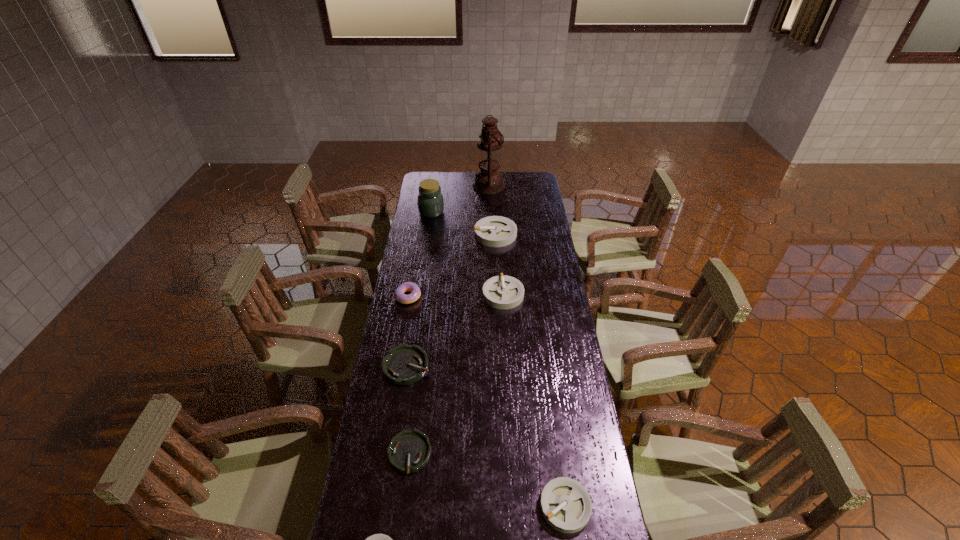
Image resolution: width=960 pixels, height=540 pixels. What are the coordinates of `the fifth farthest ashtray` in the screenshot? It's located at (566, 506).

Locate an element on the screen. This screenshot has width=960, height=540. the third farthest ashtray is located at coordinates (403, 365).

This screenshot has width=960, height=540. What are the coordinates of `the sixth farthest object` in the screenshot? It's located at (403, 365).

The width and height of the screenshot is (960, 540). Identify the location of the smaller green ashtray. (408, 451).

Where is `the nearer green ashtray`? the nearer green ashtray is located at coordinates (408, 451).

Find the location of a particular element. This screenshot has width=960, height=540. vacant point located 0.260m on the left of the tallest object is located at coordinates (428, 186).

At what (x,y) coordinates should I click in order to perform the action: click on vacant region located 0.070m on the back of the eighth nearest object. Please return your answer as a coordinate pair (x, y). Looking at the image, I should click on (433, 198).

Where is `vacant space located 0.100m on the right of the third tallest object`? The height and width of the screenshot is (540, 960). vacant space located 0.100m on the right of the third tallest object is located at coordinates (537, 234).

Identify the location of vacant position located 0.250m on the front of the fifth shortest ashtray. (x=507, y=357).

Locate an element on the screen. Image resolution: width=960 pixels, height=540 pixels. vacant space located 0.050m on the back of the pink doughnut is located at coordinates (411, 280).